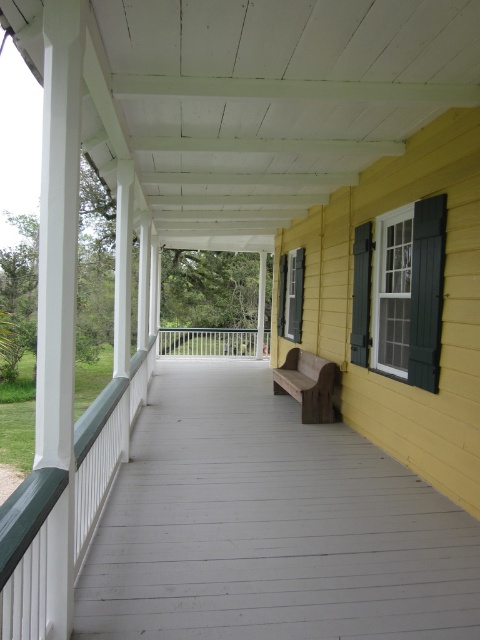
Question: Does white painted wood porch at center appear on the right side of green matte shutter at right?

Choices:
 (A) yes
 (B) no

Answer: (B)

Question: Does green matte shutter at right have a larger size compared to wooden bench at center?

Choices:
 (A) yes
 (B) no

Answer: (B)

Question: Which point is closer to the camera taking this photo?

Choices:
 (A) (278, 314)
 (B) (280, 589)

Answer: (B)

Question: Considering the relative positions of silver metallic rail at center and green painted wood shutter at upper right in the image provided, where is silver metallic rail at center located with respect to green painted wood shutter at upper right?

Choices:
 (A) below
 (B) above

Answer: (A)

Question: Which point is closer to the camera taking this photo?

Choices:
 (A) (319, 396)
 (B) (294, 250)
 (C) (267, 509)

Answer: (C)

Question: Which object appears closest to the camera in this image?

Choices:
 (A) white painted wood porch at center
 (B) green painted wood shutter at upper right
 (C) green matte shutter at right
 (D) wooden bench at center

Answer: (A)